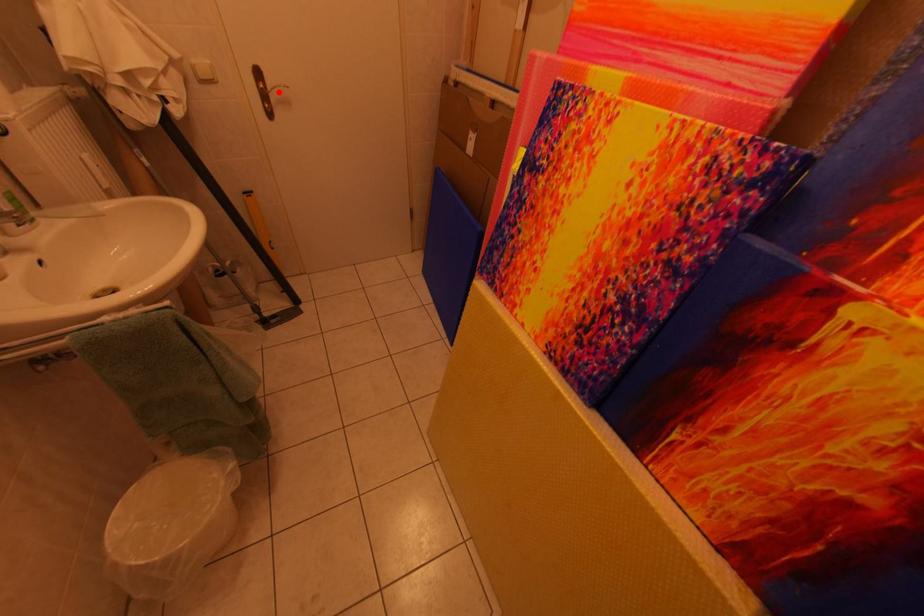
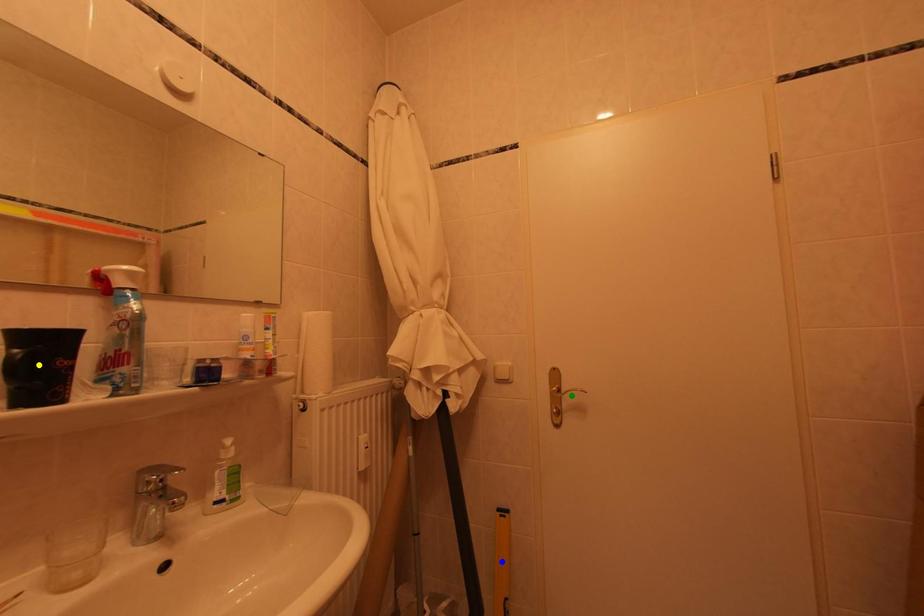
Question: I am providing you with two images of the same scene from different viewpoints. A red point is marked on the first image. You are given multiple points on the second image. Which spot in image 2 lines up with the point in image 1?

Choices:
 (A) blue point
 (B) green point
 (C) yellow point

Answer: (B)